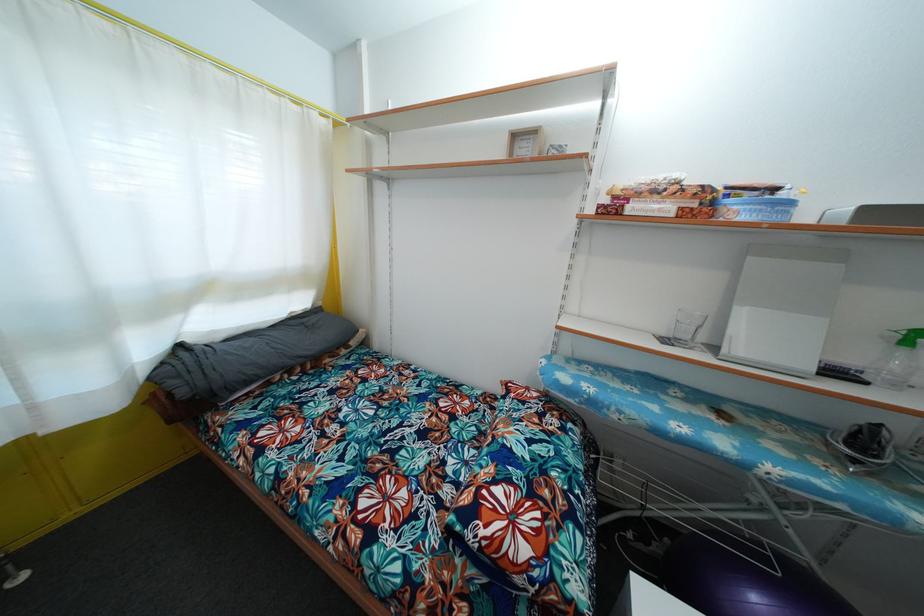
The width and height of the screenshot is (924, 616). Describe the element at coordinates (909, 338) in the screenshot. I see `the green spray bottle trigger` at that location.